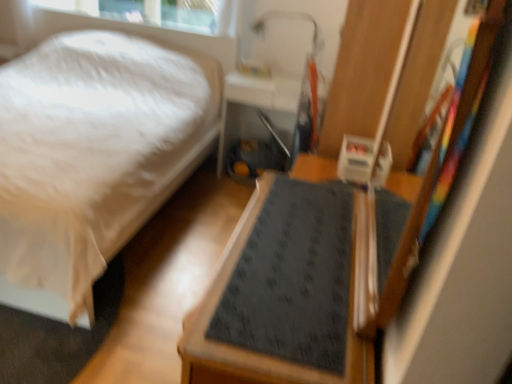
Question: Considering the relative positions of dark gray textured mat at center and metallic silver tray at center in the image provided, is dark gray textured mat at center in front of metallic silver tray at center?

Choices:
 (A) no
 (B) yes

Answer: (B)

Question: Is dark gray textured mat at center to the left of metallic silver tray at center from the viewer's perspective?

Choices:
 (A) no
 (B) yes

Answer: (A)

Question: Can you confirm if dark gray textured mat at center is taller than metallic silver tray at center?

Choices:
 (A) no
 (B) yes

Answer: (A)

Question: Considering the relative sizes of dark gray textured mat at center and metallic silver tray at center in the image provided, is dark gray textured mat at center bigger than metallic silver tray at center?

Choices:
 (A) no
 (B) yes

Answer: (B)

Question: Does dark gray textured mat at center appear on the right side of metallic silver tray at center?

Choices:
 (A) no
 (B) yes

Answer: (B)

Question: From a real-world perspective, is dark gray textured mat at center under metallic silver tray at center?

Choices:
 (A) no
 (B) yes

Answer: (B)

Question: Is white soft bed at lower left wider than dark gray textured mat at center?

Choices:
 (A) no
 (B) yes

Answer: (B)

Question: Does white soft bed at lower left turn towards dark gray textured mat at center?

Choices:
 (A) yes
 (B) no

Answer: (B)

Question: Does white soft bed at lower left appear on the right side of dark gray textured mat at center?

Choices:
 (A) no
 (B) yes

Answer: (A)

Question: From a real-world perspective, is white soft bed at lower left over dark gray textured mat at center?

Choices:
 (A) no
 (B) yes

Answer: (B)

Question: Would you consider white soft bed at lower left to be distant from dark gray textured mat at center?

Choices:
 (A) yes
 (B) no

Answer: (A)

Question: Is white soft bed at lower left to the left of dark gray textured mat at center from the viewer's perspective?

Choices:
 (A) no
 (B) yes

Answer: (B)

Question: From a real-world perspective, is metallic silver tray at center physically below dark gray textured mat at center?

Choices:
 (A) no
 (B) yes

Answer: (A)